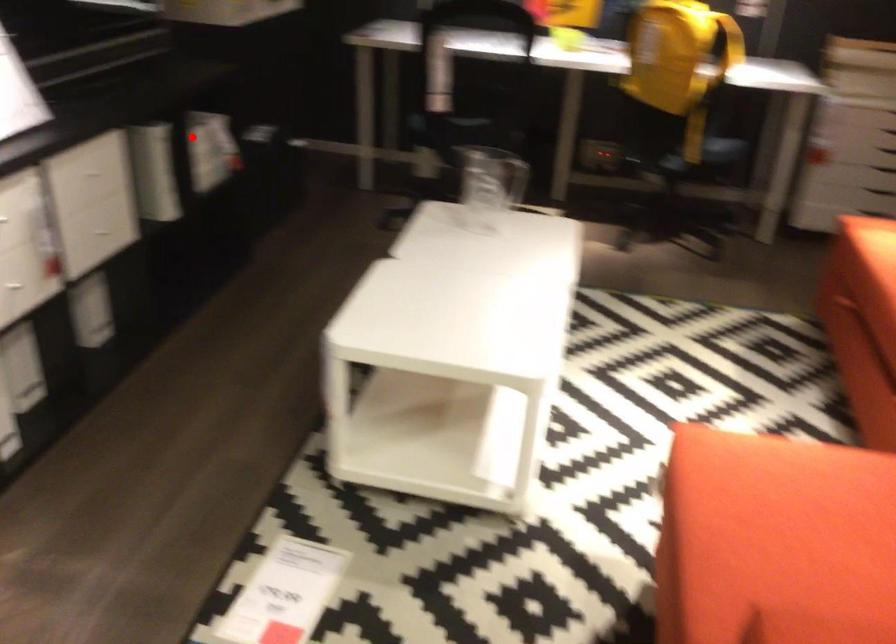
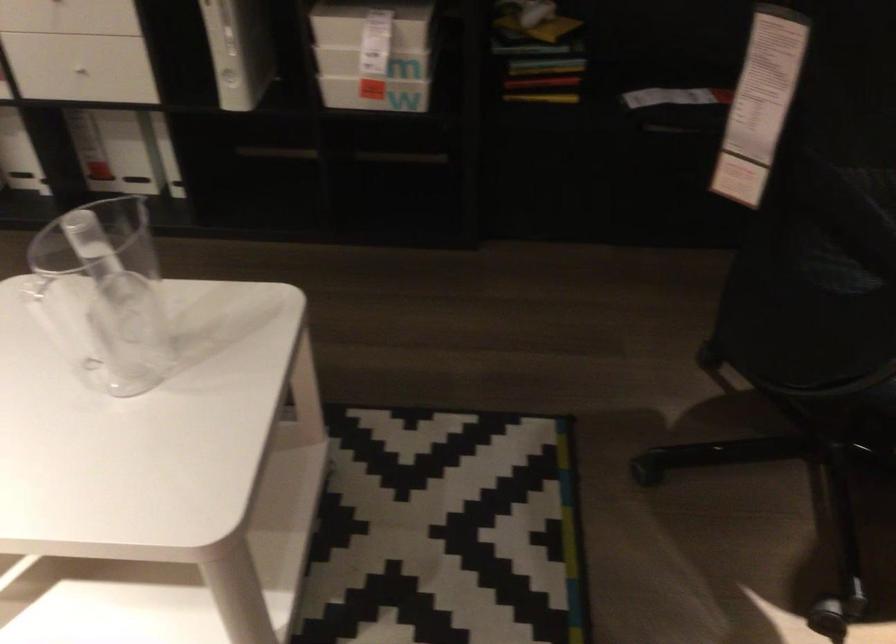
Question: I am providing you with two images of the same scene from different viewpoints. Image1 has a red point marked. In image2, the corresponding 3D location appears at what relative position? Reply with the corresponding letter.

Choices:
 (A) Closer
 (B) Farther

Answer: (A)